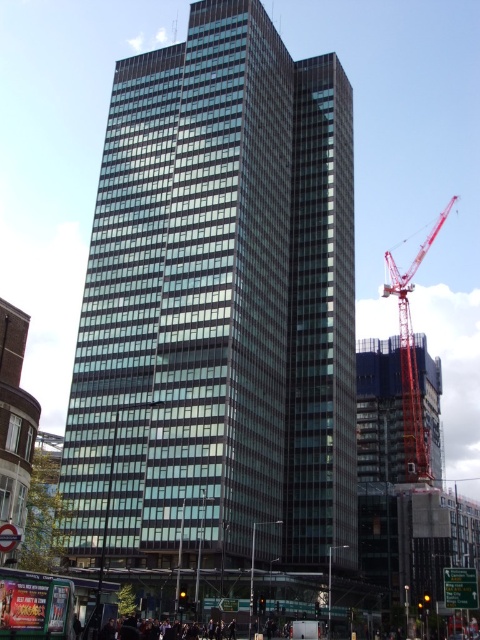
You are a drone operator trying to capture a photo of the glassy steel skyscraper at center. The drone has a GPS coordinate system where the center of the image is at point 0.5, 0.5. Is the skyscraper positioned to the left or right of the image center?

The glassy steel skyscraper at center is located at point (218, 308), which is slightly to the left of the image center at (240, 320). Therefore, the skyscraper is positioned to the left of the image center.

Consider the image. You are a city planner looking at the image of the modern high rise and construction site. You need to determine the spatial relationship between the glassy steel skyscraper at center and the red metallic crane at right. Which object is closer to the viewer?

The glassy steel skyscraper at center is positioned over the red metallic crane at right, meaning it is closer to the viewer.

You are a delivery drone flying towards the glassy steel skyscraper at center and the red metallic crane at right. Which one should you approach first based on their positions?

You should approach the glassy steel skyscraper at center first since it is positioned to the left of the red metallic crane at right, meaning it is closer to your current flight path if you are approaching from the left side.